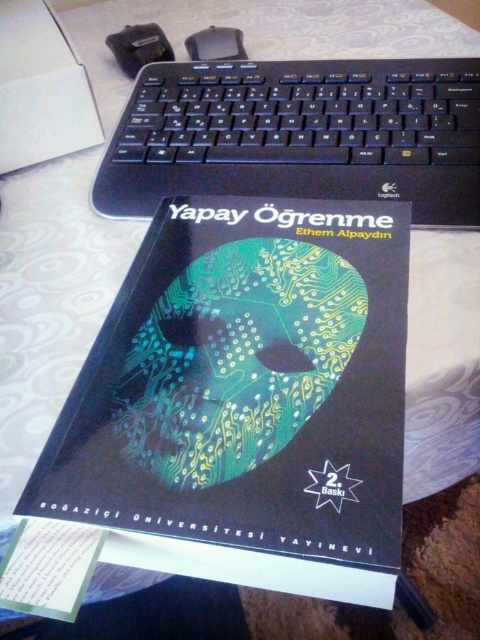
Question: Which point is farther to the camera?

Choices:
 (A) black plastic keyboard at upper center
 (B) green circuit board at center

Answer: (A)

Question: Can you confirm if green circuit board at center is thinner than black plastic keyboard at upper center?

Choices:
 (A) yes
 (B) no

Answer: (A)

Question: Is green circuit board at center thinner than black plastic keyboard at upper center?

Choices:
 (A) yes
 (B) no

Answer: (A)

Question: Which point is closer to the camera?

Choices:
 (A) green circuit board at center
 (B) black plastic keyboard at upper center

Answer: (A)

Question: Does green circuit board at center appear on the right side of black plastic keyboard at upper center?

Choices:
 (A) yes
 (B) no

Answer: (B)